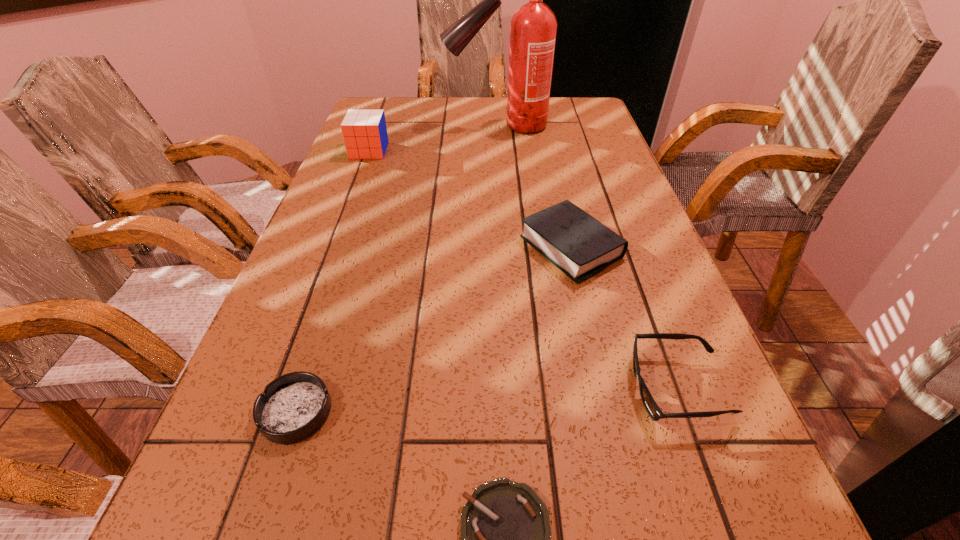
Where is `fire extinguisher`? fire extinguisher is located at coordinates (533, 28).

Where is `the tallest object`? The height and width of the screenshot is (540, 960). the tallest object is located at coordinates (533, 28).

Locate an element on the screen. This screenshot has height=540, width=960. the fifth shortest object is located at coordinates (365, 136).

Image resolution: width=960 pixels, height=540 pixels. I want to click on the fifth nearest object, so click(x=365, y=136).

Identify the location of the third farthest object. Image resolution: width=960 pixels, height=540 pixels. (579, 245).

Locate an element on the screen. sunglasses is located at coordinates (655, 413).

This screenshot has width=960, height=540. I want to click on the second shortest object, so click(x=294, y=406).

Identify the location of the left ashtray. This screenshot has height=540, width=960. (294, 406).

This screenshot has height=540, width=960. What are the coordinates of `vacant region located at the nozzle end of the farthest object` in the screenshot? It's located at (404, 126).

The image size is (960, 540). In order to click on free spot located 0.260m at the nozzle end of the farthest object in this screenshot , I will do `click(364, 126)`.